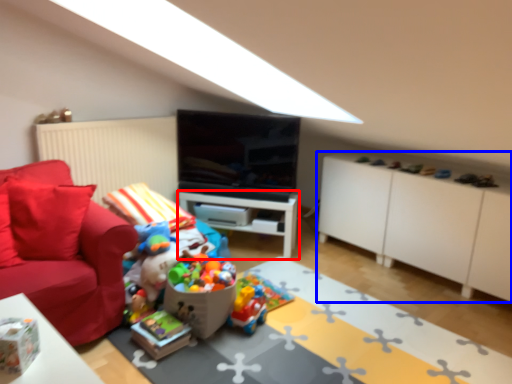
Question: Among these objects, which one is farthest to the camera, table (highlighted by a red box) or cabinetry (highlighted by a blue box)?

Choices:
 (A) table
 (B) cabinetry

Answer: (A)